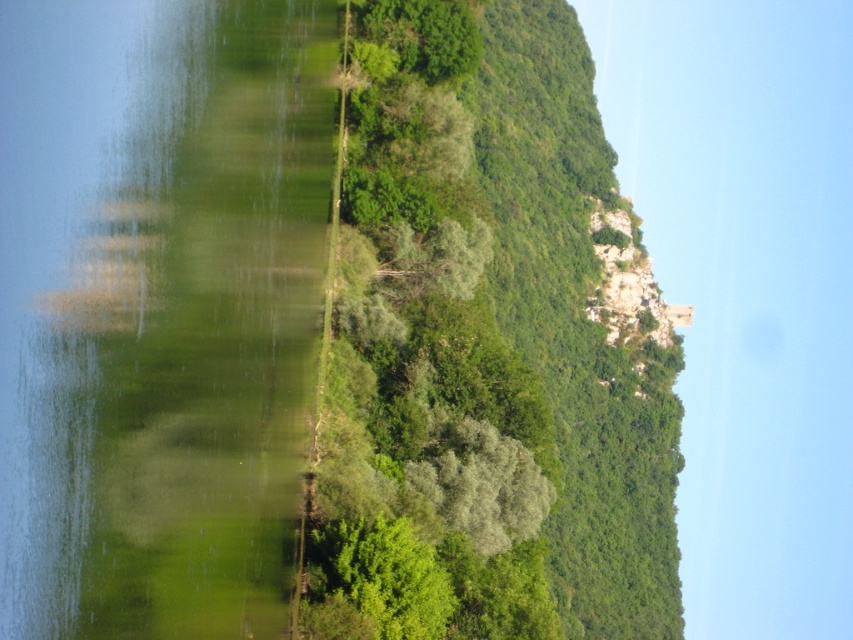
Question: Is green reflective water at left bigger than green leafy tree at center?

Choices:
 (A) no
 (B) yes

Answer: (A)

Question: Is the position of green reflective water at left less distant than that of green leafy tree at center?

Choices:
 (A) no
 (B) yes

Answer: (B)

Question: Among these objects, which one is farthest from the camera?

Choices:
 (A) green leafy tree at center
 (B) green reflective water at left

Answer: (A)

Question: Is green reflective water at left wider than green leafy tree at center?

Choices:
 (A) yes
 (B) no

Answer: (B)